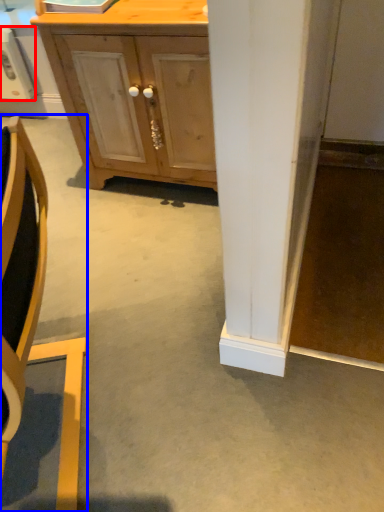
Question: Among these objects, which one is farthest to the camera, appliance (highlighted by a red box) or chair (highlighted by a blue box)?

Choices:
 (A) appliance
 (B) chair

Answer: (A)